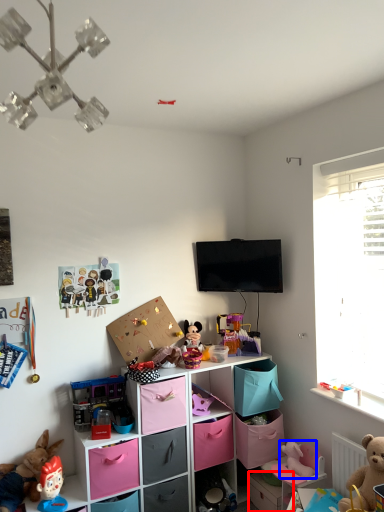
Question: Which object appears farthest to the camera in this image, storage box (highlighted by a red box) or toy (highlighted by a blue box)?

Choices:
 (A) storage box
 (B) toy

Answer: (A)